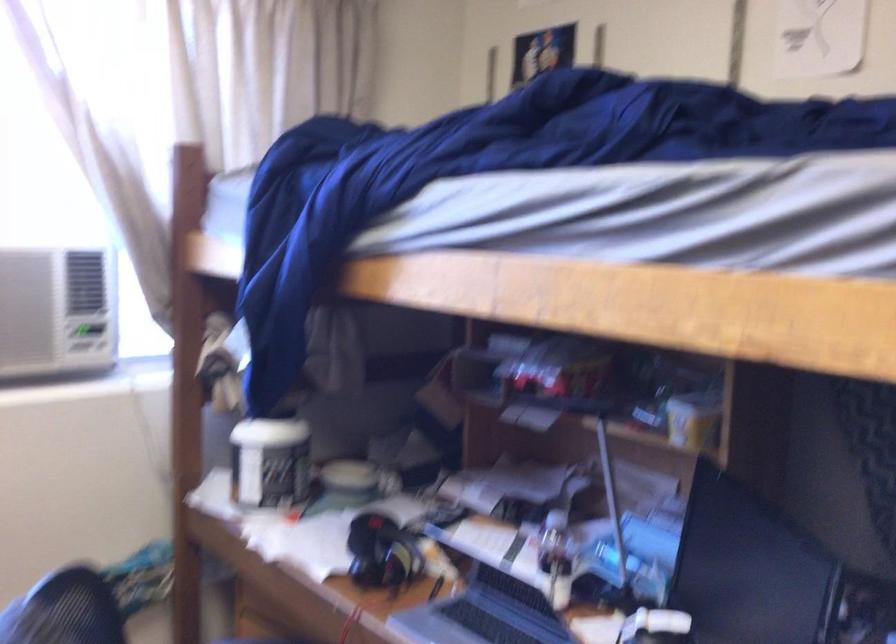
Question: The camera is either moving clockwise (left) or counter-clockwise (right) around the object. The first image is from the beginning of the video and the second image is from the end. Is the camera moving left or right when shooting the video?

Choices:
 (A) Left
 (B) Right

Answer: (A)